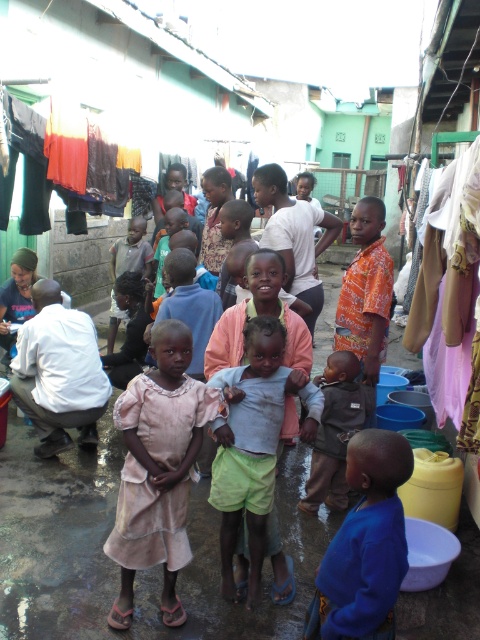
Question: Which object is farther from the camera taking this photo?

Choices:
 (A) dark gray fabric baby at center
 (B) light pink fabric at center
 (C) orange printed shirt at center
 (D) pink fabric dress at center

Answer: (B)

Question: Which is farther from the light pink fabric at center?

Choices:
 (A) orange printed shirt at center
 (B) blue cotton shirt at lower right

Answer: (B)

Question: Does blue cotton shirt at lower right appear over orange printed shirt at center?

Choices:
 (A) no
 (B) yes

Answer: (A)

Question: Considering the real-world distances, which object is closest to the blue cotton shirt at lower right?

Choices:
 (A) orange printed shirt at center
 (B) dark gray fabric baby at center
 (C) light pink fabric at center
 (D) pink fabric dress at center

Answer: (D)

Question: Is pink fabric dress at center to the left of blue cotton shirt at lower right from the viewer's perspective?

Choices:
 (A) yes
 (B) no

Answer: (A)

Question: Is dark gray fabric baby at center above light pink fabric at center?

Choices:
 (A) no
 (B) yes

Answer: (A)